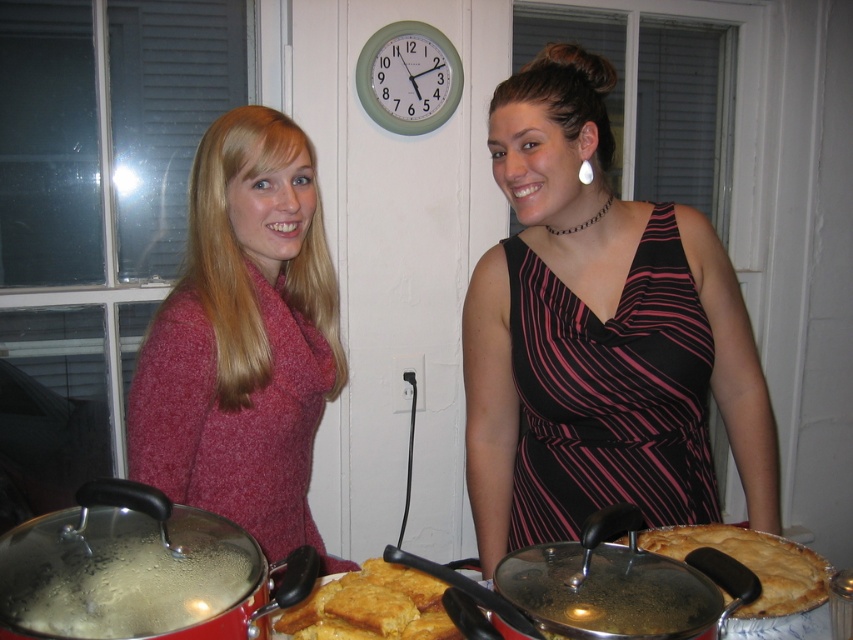
In the scene shown: Does matte red sweater at center have a greater height compared to golden flaky pie at center right?

Indeed, matte red sweater at center has a greater height compared to golden flaky pie at center right.

Is matte red sweater at center bigger than golden flaky pie at center right?

Correct, matte red sweater at center is larger in size than golden flaky pie at center right.

Between point (204, 342) and point (807, 595), which one is positioned in front?

Positioned in front is point (807, 595).

You are a GUI agent. You are given a task and a screenshot of the screen. Output one action in this format:
    pyautogui.click(x=<x>, y=<y>)
    Task: Click on the matte red sweater at center
    
    Given the screenshot: What is the action you would take?
    pyautogui.click(x=242, y=340)

Based on the photo, does golden brown crusty bread at center appear over golden flaky pie at center right?

Incorrect, golden brown crusty bread at center is not positioned above golden flaky pie at center right.

Between point (384, 570) and point (692, 540), which one is positioned behind?

Positioned behind is point (692, 540).

Locate an element on the screen. This screenshot has width=853, height=640. golden brown crusty bread at center is located at coordinates (372, 605).

Who is more forward, (x=582, y=221) or (x=337, y=582)?

Point (x=337, y=582)

Based on the photo, can you confirm if black striped dress at center is thinner than golden brown crusty bread at center?

Incorrect, black striped dress at center's width is not less than golden brown crusty bread at center's.

Which is behind, point (717, 278) or point (364, 602)?

Positioned behind is point (717, 278).

Find the location of a particular element. This screenshot has width=853, height=640. black striped dress at center is located at coordinates (598, 336).